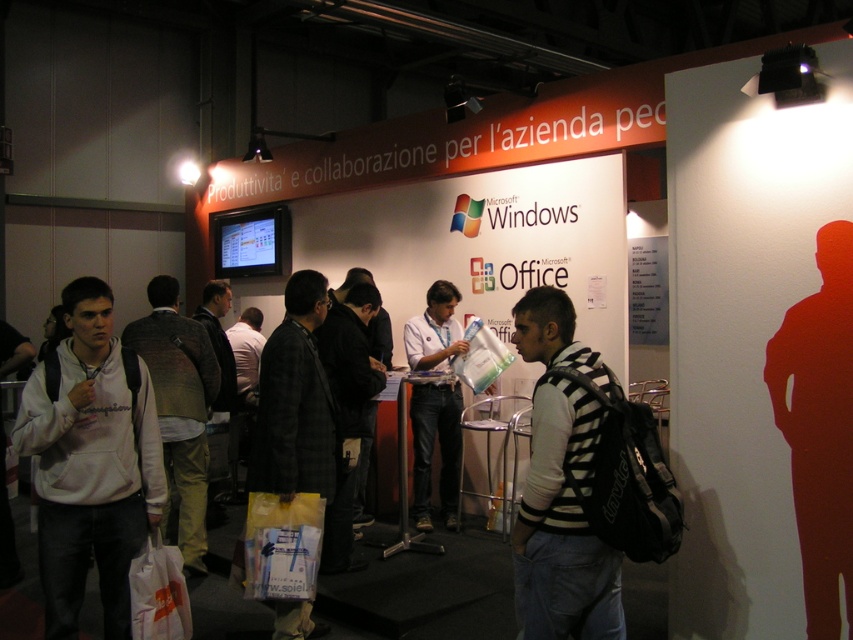
Question: Estimate the real-world distances between objects in this image. Which object is farther from the light gray sweater at center?

Choices:
 (A) dark gray jacket at center
 (B) dark gray plaid jacket at center
 (C) khaki cotton pants at center
 (D) striped sweater at center

Answer: (D)

Question: Is dark gray jacket at center to the left of dark gray sweater at center from the viewer's perspective?

Choices:
 (A) no
 (B) yes

Answer: (A)

Question: Is dark gray plaid jacket at center positioned in front of dark gray jacket at center?

Choices:
 (A) no
 (B) yes

Answer: (B)

Question: Which point is farther from the camera taking this photo?

Choices:
 (A) coord(819,384)
 (B) coord(181,358)
 (C) coord(231,336)

Answer: (C)

Question: Which point is closer to the camera?

Choices:
 (A) dark gray plaid jacket at center
 (B) light gray sweater at center

Answer: (A)

Question: Is white fleece hoodie at left to the right of dark gray jacket at center from the viewer's perspective?

Choices:
 (A) yes
 (B) no

Answer: (B)